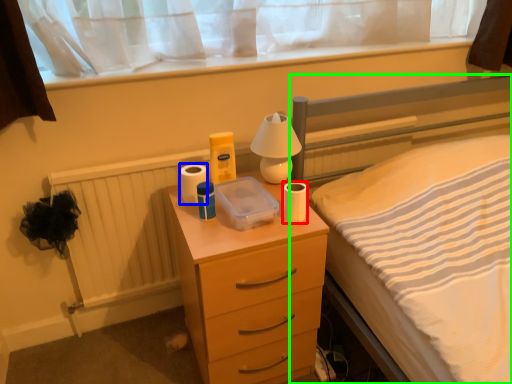
Question: Which object is the closest to the toilet paper (highlighted by a red box)? Choose among these: toilet paper (highlighted by a blue box) or bed (highlighted by a green box).

Choices:
 (A) toilet paper
 (B) bed

Answer: (A)